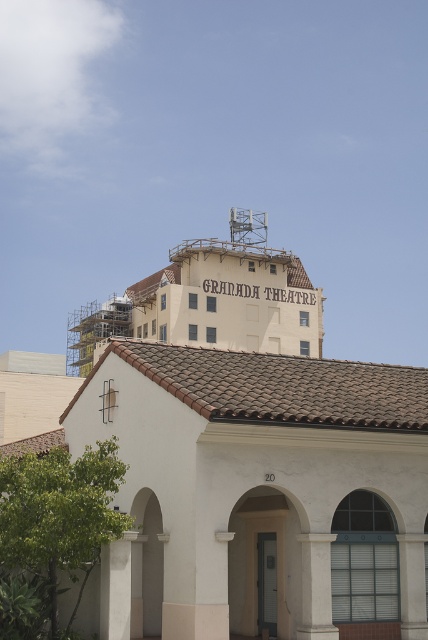
Question: Observing the image, what is the correct spatial positioning of white stone column at center in reference to white concrete pillar at lower left?

Choices:
 (A) below
 (B) above

Answer: (A)

Question: Is white stone column at center positioned at the back of white concrete pillar at lower left?

Choices:
 (A) no
 (B) yes

Answer: (B)

Question: Is white stone column at center further to camera compared to white concrete pillar at lower left?

Choices:
 (A) yes
 (B) no

Answer: (A)

Question: Which of the following is the farthest from the observer?

Choices:
 (A) white concrete pillar at lower left
 (B) white stone column at center

Answer: (B)